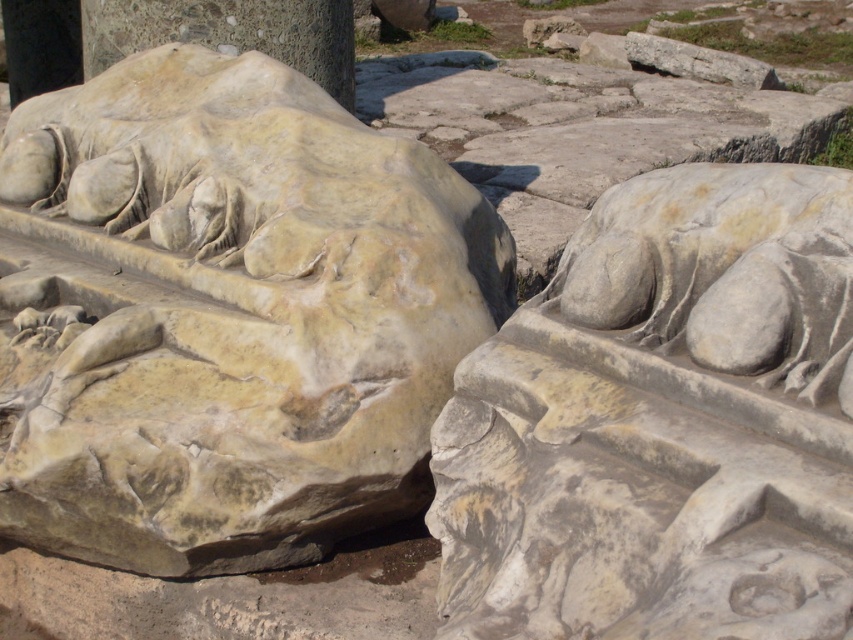
You are an archaeologist examining the ancient stone carvings. You notice two distinct areas of stone material in the image. The matte stone sculpture at center and the smooth gray stone at center. Which one is closer to you, the observer?

The matte stone sculpture at center is closer to you because it is in front of the smooth gray stone at center.

You are an archaeologist examining the ancient stone carvings. You notice a point marked at coordinates (663, 422). What object is located at that specific coordinate?

The gray stone sculpture at center is located at point (663, 422).